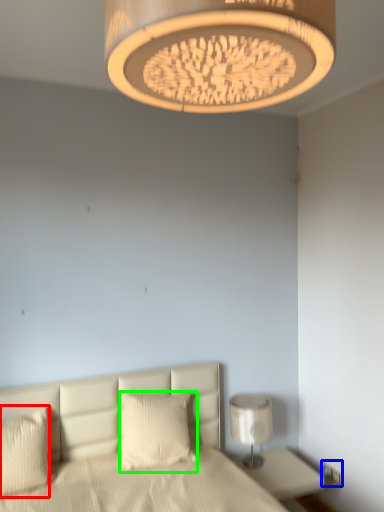
Question: Estimate the real-world distances between objects in this image. Which object is closer to pillow (highlighted by a red box), electric outlet (highlighted by a blue box) or pillow (highlighted by a green box)?

Choices:
 (A) electric outlet
 (B) pillow

Answer: (B)